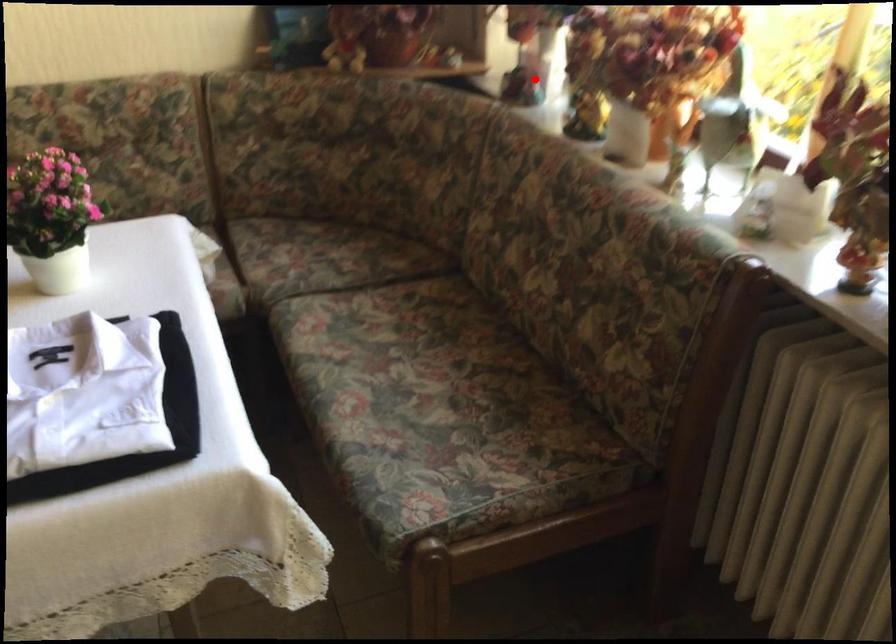
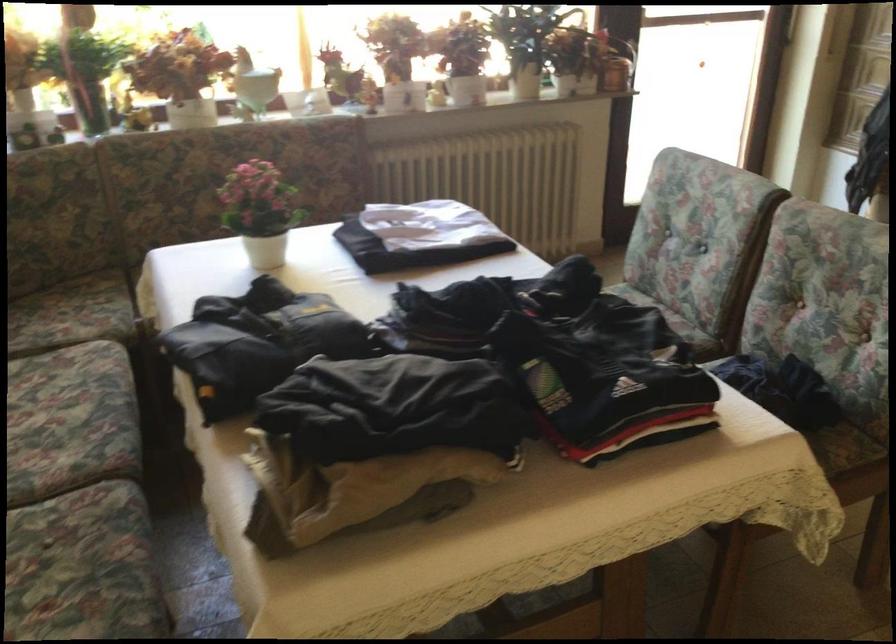
Question: I am providing you with two images of the same scene from different viewpoints. Image1 has a red point marked. In image2, the corresponding 3D location appears at what relative position? Reply with the corresponding letter.

Choices:
 (A) Closer
 (B) Farther

Answer: (B)